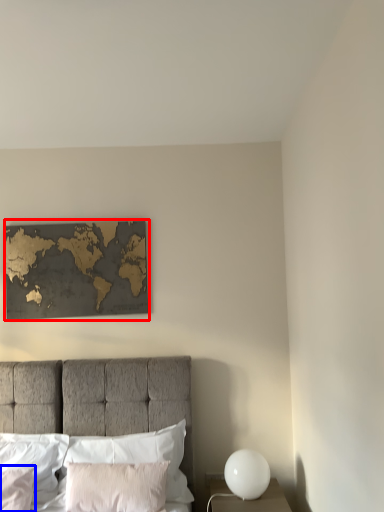
Question: Which object is closer to the camera taking this photo, picture frame (highlighted by a red box) or pillow (highlighted by a blue box)?

Choices:
 (A) picture frame
 (B) pillow

Answer: (B)